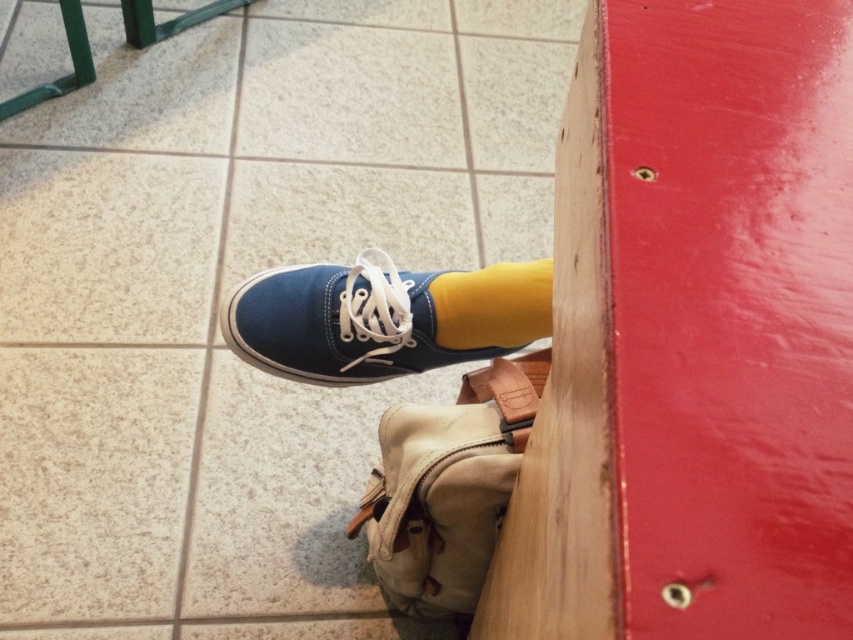
You are trying to decide which item to place in a box that can only fit one of them. Based on their sizes, which one between the blue canvas shoe at center and the yellow cotton sock at center should you choose to fit better?

The blue canvas shoe at center has a larger size compared to the yellow cotton sock at center, so the yellow cotton sock at center would fit better in the box designed for one item.

You are trying to put on your blue canvas shoe at center and yellow cotton sock at center. Which item should you put on first based on their positions?

The blue canvas shoe at center is taller than yellow cotton sock at center, so you should put on the yellow cotton sock at center first before the blue canvas shoe at center.